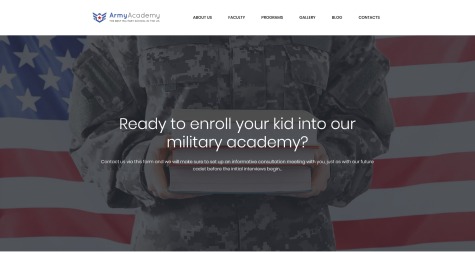
Locate an element on the screen. books is located at coordinates (269, 178), (277, 155), (280, 133).